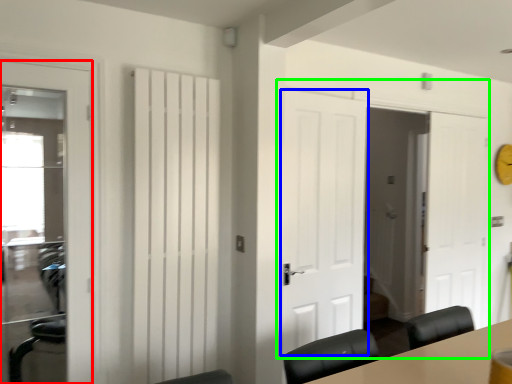
Question: Based on their relative distances, which object is farther from door (highlighted by a red box)? Choose from door (highlighted by a blue box) and door (highlighted by a green box).

Choices:
 (A) door
 (B) door

Answer: (B)